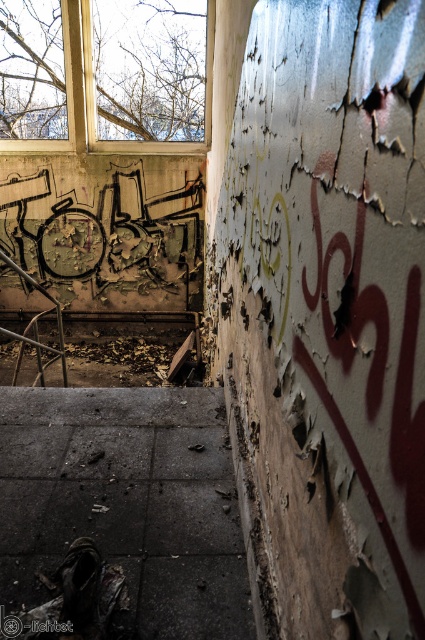
You are a delivery person carrying a large box that is 1 meter wide. You need to navigate through the dark concrete stairs at center and the wooden frame window at upper left. Which path allows your box to pass through without getting stuck?

The wooden frame window at upper left allows the box to pass through since its width is greater than the dark concrete stairs at center.

You are standing at the base of the staircase in the dilapidated interior. You notice two points marked on the wall. The first point is at coordinates point (138, 552), and the second is at point (8, 316). If you were to walk towards the wall, which point would you encounter first?

Point (138, 552) is in front of point (8, 316), so you would encounter point (138, 552) first when walking towards the wall.